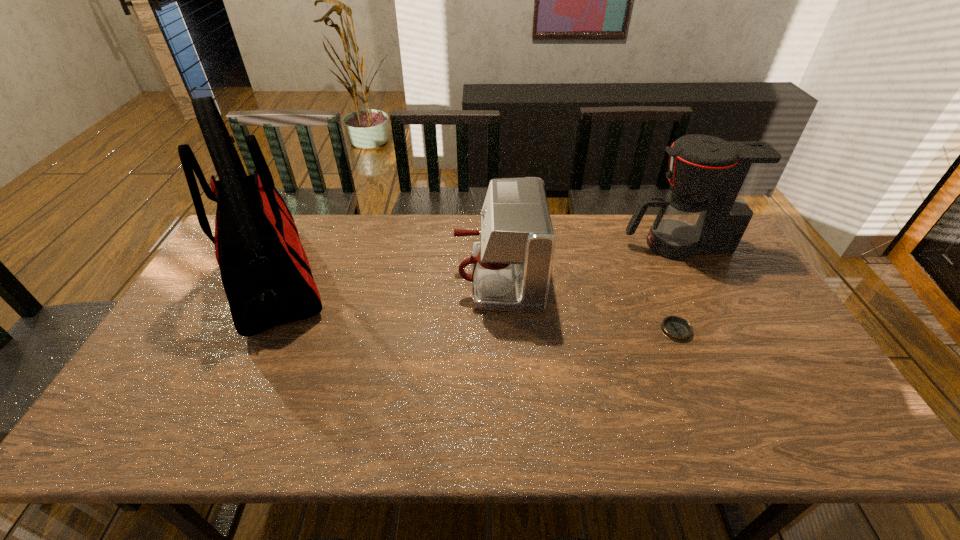
Find the location of a particular element. blank space located 0.150m pour from the carafe of the right coffee maker is located at coordinates (579, 245).

At what (x,y) coordinates should I click in order to perform the action: click on free location located 0.210m on the front of the second object from left to right near the spout. Please return your answer as a coordinate pair (x, y). The width and height of the screenshot is (960, 540). Looking at the image, I should click on (388, 278).

At what (x,y) coordinates should I click in order to perform the action: click on vacant region located on the front of the second object from left to right near the spout. Please return your answer as a coordinate pair (x, y). The image size is (960, 540). Looking at the image, I should click on (432, 278).

What are the coordinates of `free point located 0.220m on the front of the second object from left to right near the spout` in the screenshot? It's located at (384, 278).

The width and height of the screenshot is (960, 540). Identify the location of vacant space situated on the left of the shortest object. (530, 330).

Where is `duffel bag that is at the far edge`? This screenshot has height=540, width=960. duffel bag that is at the far edge is located at coordinates (265, 272).

Locate an element on the screen. This screenshot has width=960, height=540. object at the left edge is located at coordinates (265, 272).

Locate an element on the screen. object positioned at the right edge is located at coordinates (716, 185).

The height and width of the screenshot is (540, 960). What are the coordinates of `object that is at the far left corner` in the screenshot? It's located at (265, 272).

The height and width of the screenshot is (540, 960). I want to click on object that is at the far right corner, so click(716, 185).